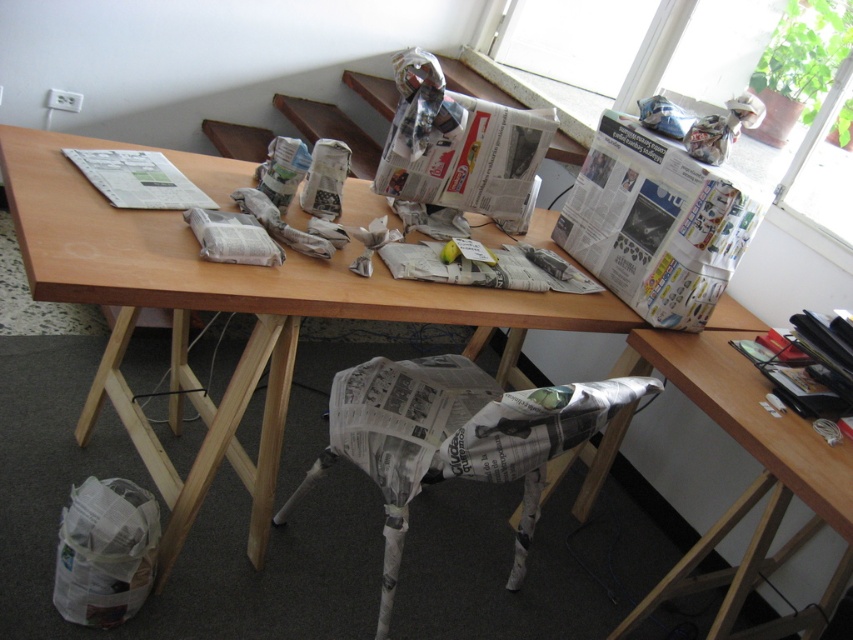
Is newspaper-covered chair at lower center shorter than white newspaper at upper left?

No, newspaper-covered chair at lower center is not shorter than white newspaper at upper left.

Which is more to the right, newspaper-covered chair at lower center or white newspaper at upper left?

newspaper-covered chair at lower center

Who is more forward, (415, 465) or (122, 177)?

Point (415, 465)

Locate an element on the screen. The width and height of the screenshot is (853, 640). newspaper-covered chair at lower center is located at coordinates (454, 440).

Is newspaper-covered chair at lower center closer to camera compared to wooden table at lower right?

That is False.

Looking at this image, who is higher up, newspaper-covered chair at lower center or wooden table at lower right?

newspaper-covered chair at lower center is higher up.

Who is more forward, (434, 470) or (701, 358)?

Point (434, 470) is in front.

At what (x,y) coordinates should I click in order to perform the action: click on newspaper-covered chair at lower center. Please return your answer as a coordinate pair (x, y). Looking at the image, I should click on (454, 440).

From the picture: Who is more forward, (743, 380) or (177, 168)?

Point (743, 380)

What do you see at coordinates (751, 483) in the screenshot? I see `wooden table at lower right` at bounding box center [751, 483].

Where is `wooden table at lower right`? The height and width of the screenshot is (640, 853). wooden table at lower right is located at coordinates (751, 483).